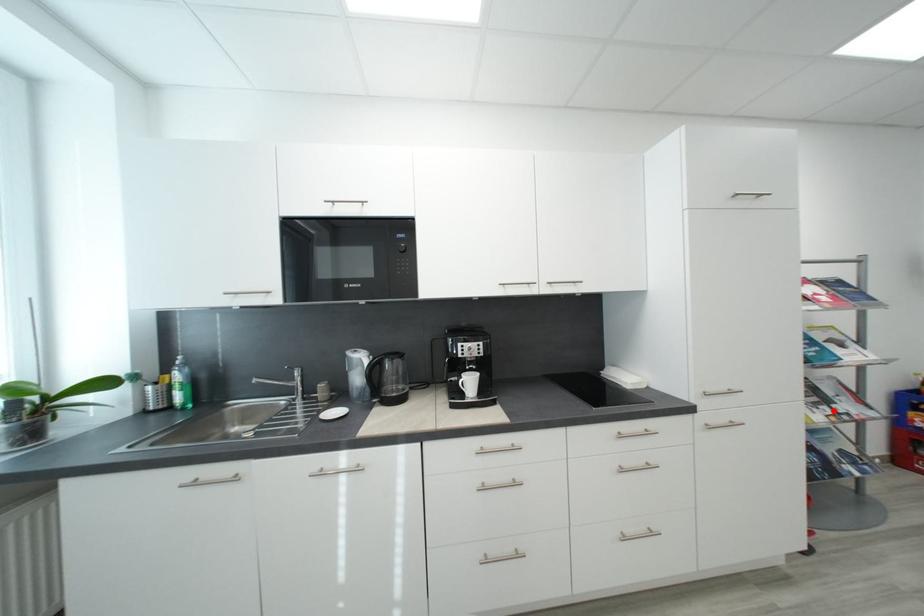
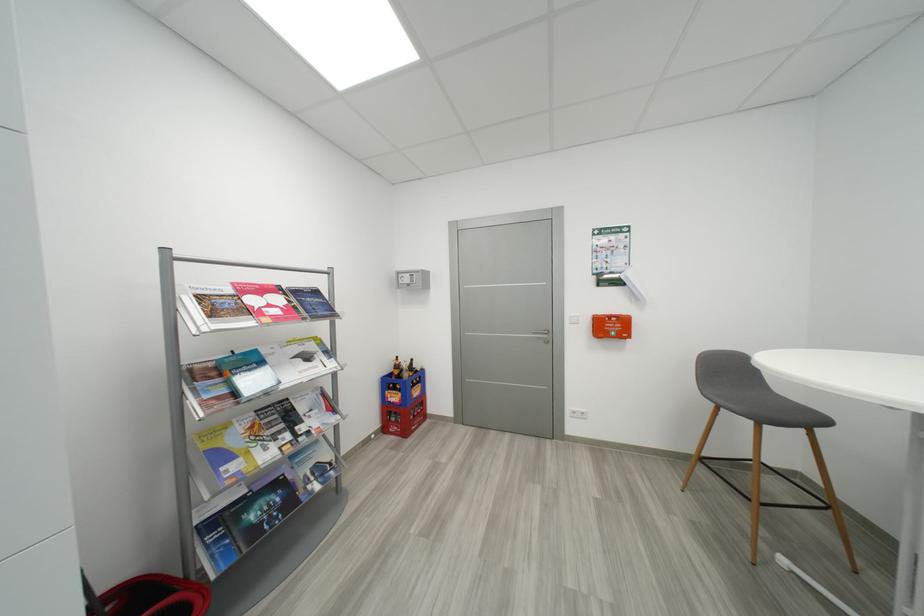
In the second image, find the point that corresponds to the highlighted location in the first image.

(294, 438)